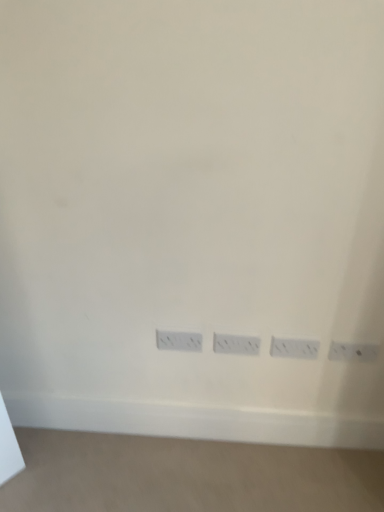
Question: Is white plastic power plugs and sockets at lower center, which appears as the first power plugs and sockets when viewed from the left, situated inside white plastic power plugs and sockets at lower right, placed as the 4th power plugs and sockets when sorted from left to right, or outside?

Choices:
 (A) outside
 (B) inside

Answer: (A)

Question: From a real-world perspective, is white plastic power plugs and sockets at lower center, which is counted as the 4th power plugs and sockets, starting from the right, above or below white plastic power plugs and sockets at lower right, the 1th power plugs and sockets from the right?

Choices:
 (A) above
 (B) below

Answer: (B)

Question: Estimate the real-world distances between objects in this image. Which object is farther from the white plastic power plugs and sockets at lower center, which is counted as the 4th power plugs and sockets, starting from the right?

Choices:
 (A) white plastic power plugs and sockets at center, which is the second power plugs and sockets from right to left
 (B) white plastic power plugs and sockets at center, positioned as the third power plugs and sockets in right-to-left order
 (C) white plastic power plugs and sockets at lower right, the 1th power plugs and sockets from the right

Answer: (C)

Question: Which is farther from the white plastic power plugs and sockets at center, the second power plugs and sockets when ordered from left to right?

Choices:
 (A) white plastic power plugs and sockets at lower center, which is counted as the 4th power plugs and sockets, starting from the right
 (B) white plastic power plugs and sockets at lower right, the 1th power plugs and sockets from the right
 (C) white plastic power plugs and sockets at center, which is the second power plugs and sockets from right to left

Answer: (B)